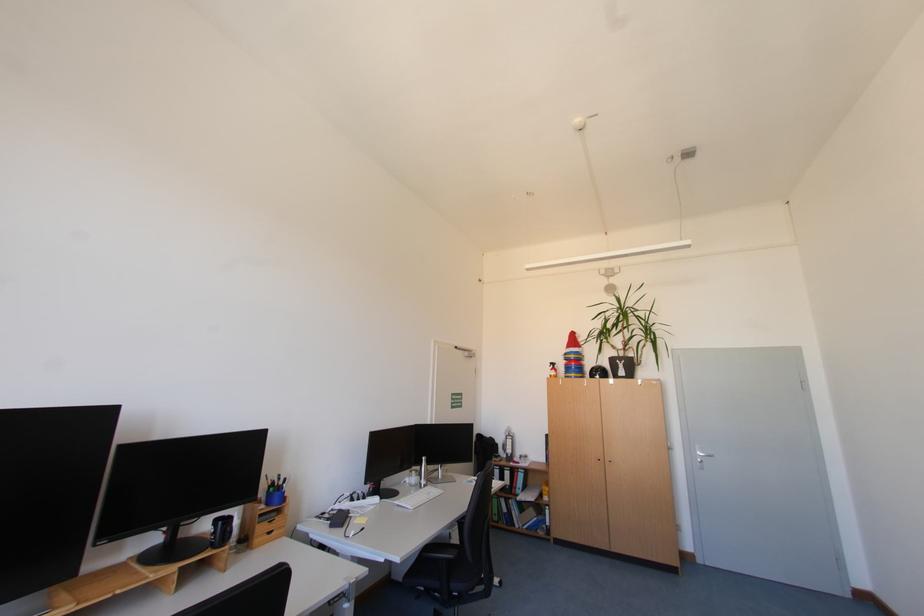
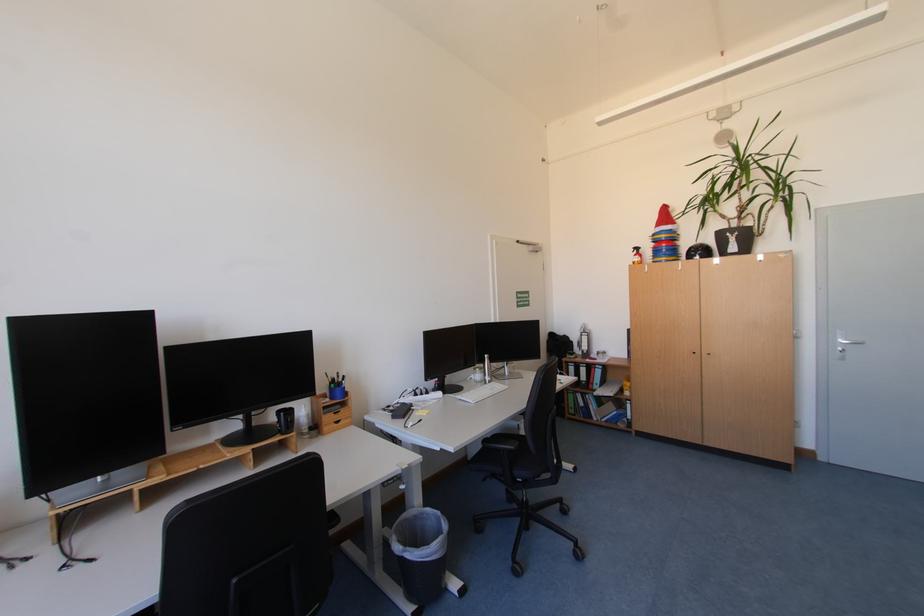
The point at [628,367] is marked in the first image. Where is the corresponding point in the second image?

(739, 241)